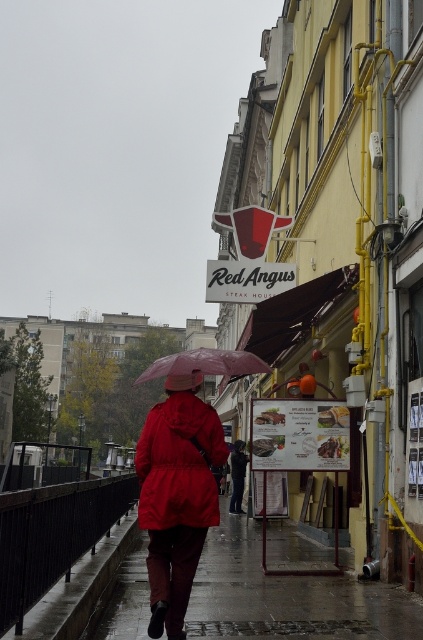
What do you see at coordinates (288, 596) in the screenshot? The height and width of the screenshot is (640, 423). I see `wet asphalt pavement at lower center` at bounding box center [288, 596].

Does wet asphalt pavement at lower center have a smaller size compared to matte red jacket at center?

No.

Is point (302, 600) more distant than point (147, 500)?

Yes, it is behind point (147, 500).

The image size is (423, 640). Identify the location of wet asphalt pavement at lower center. (288, 596).

Is matte red jacket at center to the left of transparent plastic umbrella at center from the viewer's perspective?

Correct, you'll find matte red jacket at center to the left of transparent plastic umbrella at center.

Which is in front, point (206, 404) or point (249, 353)?

Positioned in front is point (206, 404).

Who is more forward, (203, 484) or (156, 371)?

Positioned in front is point (203, 484).

The height and width of the screenshot is (640, 423). I want to click on matte red jacket at center, so click(x=178, y=464).

Does wet asphalt pavement at lower center have a larger size compared to transparent plastic umbrella at center?

Yes, wet asphalt pavement at lower center is bigger than transparent plastic umbrella at center.

Can you confirm if wet asphalt pavement at lower center is thinner than transparent plastic umbrella at center?

No.

Is point (236, 516) more distant than point (233, 376)?

Yes, it is behind point (233, 376).

Where is `wet asphalt pavement at lower center`? This screenshot has width=423, height=640. wet asphalt pavement at lower center is located at coordinates (288, 596).